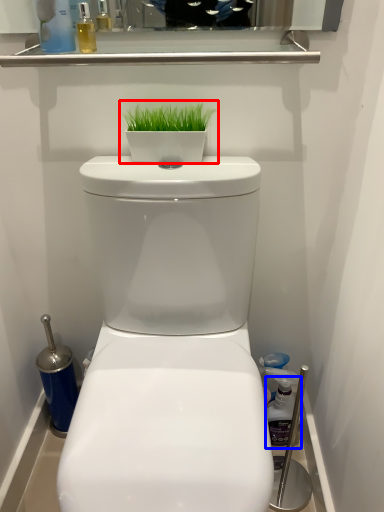
Question: Which of the following is the closest to the observer, houseplant (highlighted by a red box) or cleaning product (highlighted by a blue box)?

Choices:
 (A) houseplant
 (B) cleaning product

Answer: (A)